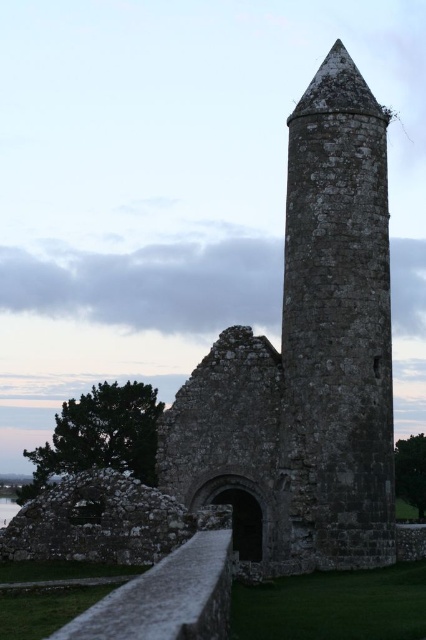
Does rustic stone tower at center have a larger size compared to rough stone tower at center?

Yes, rustic stone tower at center is bigger than rough stone tower at center.

Can you confirm if rustic stone tower at center is positioned to the left of rough stone tower at center?

Correct, you'll find rustic stone tower at center to the left of rough stone tower at center.

Which is behind, point (342, 236) or point (371, 490)?

The point (342, 236) is more distant.

Locate an element on the screen. The image size is (426, 640). rustic stone tower at center is located at coordinates (307, 356).

Describe the element at coordinates (336, 326) in the screenshot. I see `rough stone tower at center` at that location.

Is rough stone tower at center closer to camera compared to transparent water at lower left?

No, rough stone tower at center is behind transparent water at lower left.

Describe the element at coordinates (336, 326) in the screenshot. Image resolution: width=426 pixels, height=640 pixels. I see `rough stone tower at center` at that location.

This screenshot has width=426, height=640. I want to click on rough stone tower at center, so click(336, 326).

Find the location of a particular element. The height and width of the screenshot is (640, 426). rustic stone tower at center is located at coordinates (307, 356).

Between point (224, 476) and point (0, 504), which one is positioned in front?

Point (224, 476) is more forward.

Identify the location of rustic stone tower at center. The image size is (426, 640). (307, 356).

The width and height of the screenshot is (426, 640). What are the coordinates of `rustic stone tower at center` in the screenshot? It's located at (307, 356).